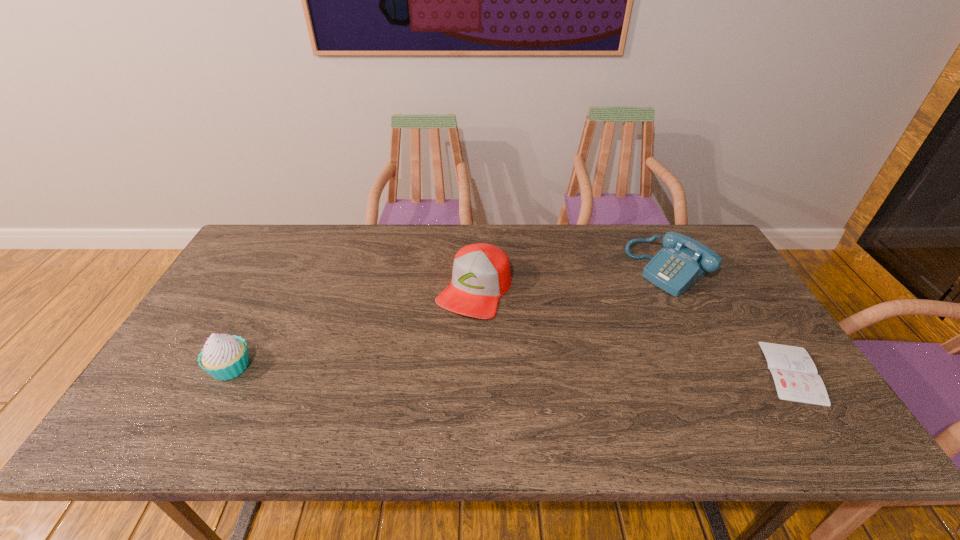
Image resolution: width=960 pixels, height=540 pixels. I want to click on free spot on the desktop that is between the leftmost object and the diary and is positioned on the dial of the telephone, so click(516, 369).

Image resolution: width=960 pixels, height=540 pixels. Find the location of `vacant space on the desktop that is between the cupcake and the shortest object and is positioned on the front-facing side of the second object from left to right`. vacant space on the desktop that is between the cupcake and the shortest object and is positioned on the front-facing side of the second object from left to right is located at coordinates (426, 369).